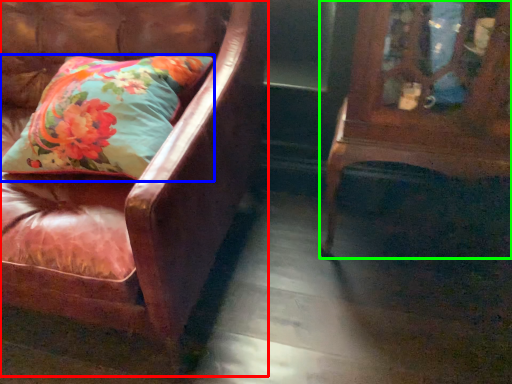
Question: Which object is positioned farthest from chair (highlighted by a red box)? Select from pillow (highlighted by a blue box) and furniture (highlighted by a green box).

Choices:
 (A) pillow
 (B) furniture

Answer: (B)